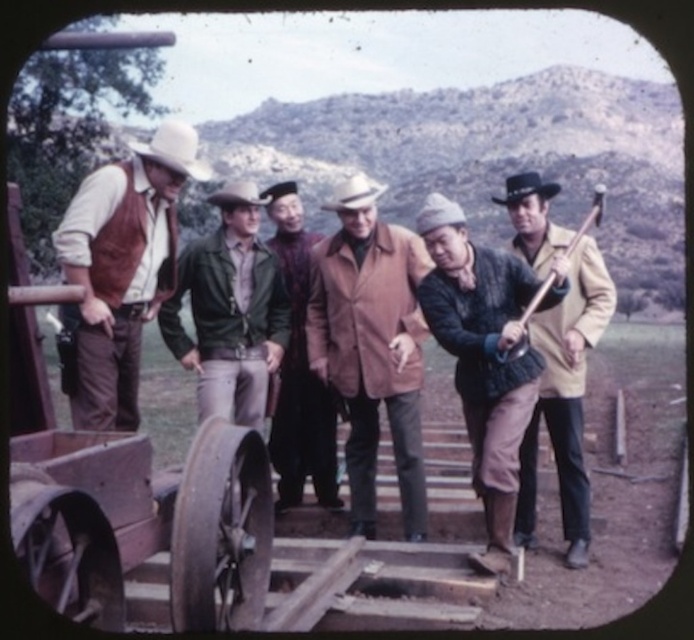
Question: Can you confirm if white matte cowboy hat at left is positioned to the right of black felt cowboy hat at center?

Choices:
 (A) yes
 (B) no

Answer: (B)

Question: Where is brown wool coat at center located in relation to white matte cowboy hat at left in the image?

Choices:
 (A) left
 (B) right

Answer: (B)

Question: Can you confirm if green leather jacket at center is positioned to the right of white matte cowboy hat at left?

Choices:
 (A) no
 (B) yes

Answer: (B)

Question: Which point appears closest to the camera in this image?

Choices:
 (A) (490, 317)
 (B) (194, 132)
 (C) (325, 355)
 (D) (593, 320)

Answer: (A)

Question: Which of the following is the farthest from the observer?

Choices:
 (A) leather jacket at center
 (B) white matte cowboy hat at center
 (C) knitted sweater at center
 (D) brown leather jacket at center

Answer: (B)

Question: Which point is closer to the camera?

Choices:
 (A) (511, 192)
 (B) (557, 244)

Answer: (B)